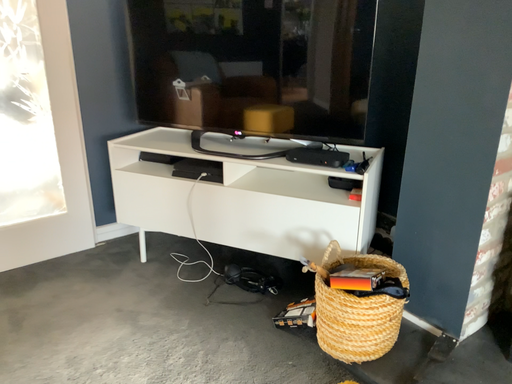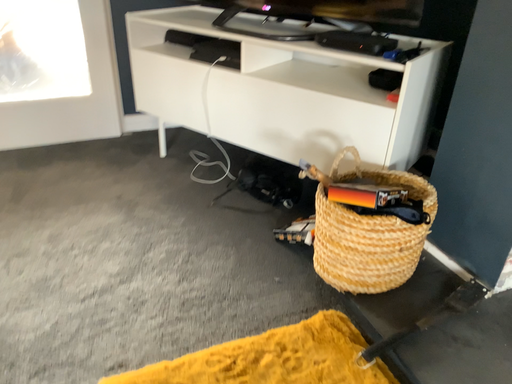
Question: Which way did the camera rotate in the video?

Choices:
 (A) rotated upward
 (B) rotated downward

Answer: (B)